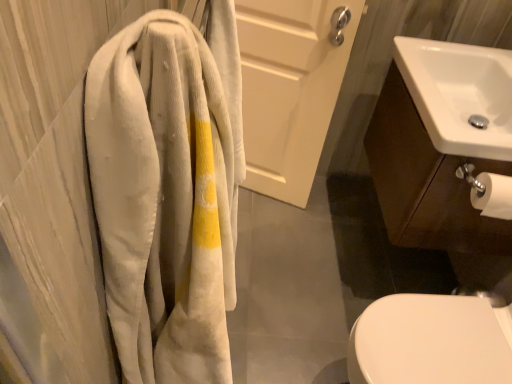
At what (x,y) coordinates should I click in order to perform the action: click on white matte door at upper center. Please return your answer as a coordinate pair (x, y). Looking at the image, I should click on (291, 87).

What do you see at coordinates (460, 95) in the screenshot?
I see `white glossy sink at upper right` at bounding box center [460, 95].

In order to click on corduroy towel at left in this screenshot , I will do `click(163, 199)`.

In the scene shown: Considering the relative sizes of white matte door at upper center and white glossy sink at right in the image provided, is white matte door at upper center taller than white glossy sink at right?

Yes.

Image resolution: width=512 pixels, height=384 pixels. I want to click on bathroom cabinet above the white matte door at upper center (from a real-world perspective), so click(x=426, y=180).

Is white matte door at upper center beside white glossy sink at right?

No.

Would you consider corduroy towel at left to be distant from white glossy sink at right?

No, corduroy towel at left is not far away from white glossy sink at right.

Does corduroy towel at left have a lesser height compared to white glossy sink at right?

Incorrect, the height of corduroy towel at left does not fall short of that of white glossy sink at right.

Based on the photo, between corduroy towel at left and white glossy sink at right, which one appears on the right side from the viewer's perspective?

From the viewer's perspective, white glossy sink at right appears more on the right side.

Between point (104, 61) and point (413, 165), which one is positioned in front?

The point (104, 61) is in front.

From the image's perspective, which one is positioned higher, white glossy sink at right or white matte door at upper center?

white matte door at upper center is shown above in the image.

Considering the points (405, 140) and (331, 95), which point is in front, point (405, 140) or point (331, 95)?

The point (405, 140) is closer to the camera.

From a real-world perspective, is white glossy sink at right located beneath white matte door at upper center?

No, from a real-world perspective, white glossy sink at right is not below white matte door at upper center.

Considering the relative sizes of white glossy sink at right and white matte door at upper center in the image provided, is white glossy sink at right smaller than white matte door at upper center?

Actually, white glossy sink at right might be larger than white matte door at upper center.

From their relative heights in the image, would you say white glossy sink at upper right is taller or shorter than white glossy sink at right?

white glossy sink at upper right is shorter than white glossy sink at right.

Would you consider white glossy sink at upper right to be distant from white glossy sink at right?

No, white glossy sink at upper right is not far away from white glossy sink at right.

Is white glossy sink at upper right surrounding white glossy sink at right?

No, white glossy sink at right is located outside of white glossy sink at upper right.

How far apart are white glossy sink at upper right and white glossy sink at right?

They are 18.99 centimeters apart.

Is point (97, 77) positioned after point (323, 56)?

That is False.

Would you say white matte door at upper center is part of corduroy towel at left's contents?

That's incorrect, white matte door at upper center is not inside corduroy towel at left.

Is corduroy towel at left smaller than white matte door at upper center?

Yes, corduroy towel at left is smaller than white matte door at upper center.

Considering the relative sizes of corduroy towel at left and white matte door at upper center in the image provided, is corduroy towel at left thinner than white matte door at upper center?

Incorrect, the width of corduroy towel at left is not less than that of white matte door at upper center.

Is white matte door at upper center at the right side of corduroy towel at left?

Indeed, white matte door at upper center is positioned on the right side of corduroy towel at left.

Which of these two, white matte door at upper center or corduroy towel at left, is bigger?

With larger size is white matte door at upper center.

Could you tell me if white matte door at upper center is facing corduroy towel at left?

Yes.

From a real-world perspective, is white matte door at upper center physically below corduroy towel at left?

Yes, from a real-world perspective, white matte door at upper center is under corduroy towel at left.

Which object is further away from the camera taking this photo, corduroy towel at left or white glossy sink at upper right?

white glossy sink at upper right is behind.

Is corduroy towel at left beside white glossy sink at upper right?

No, corduroy towel at left is not in contact with white glossy sink at upper right.

From the image's perspective, is corduroy towel at left on top of white glossy sink at upper right?

No, from the image's perspective, corduroy towel at left is not over white glossy sink at upper right.

Does corduroy towel at left appear on the left side of white glossy sink at upper right?

Yes.

Find the location of `screen door that appears on the left of white glossy sink at right`. screen door that appears on the left of white glossy sink at right is located at coordinates (291, 87).

Where is `bathroom cabinet on the right side of corduroy towel at left`? This screenshot has height=384, width=512. bathroom cabinet on the right side of corduroy towel at left is located at coordinates (426, 180).

Looking at the image, which one is located further to white matte door at upper center, white glossy sink at upper right or white glossy sink at right?

The object further to white matte door at upper center is white glossy sink at upper right.

Considering their positions, is white glossy sink at right positioned closer to corduroy towel at left than white glossy sink at upper right?

Based on the image, white glossy sink at right appears to be nearer to corduroy towel at left.

Looking at the image, which one is located further to corduroy towel at left, white glossy sink at right or white matte door at upper center?

The object further to corduroy towel at left is white matte door at upper center.

Based on the photo, considering their positions, is corduroy towel at left positioned further to white glossy sink at upper right than white glossy sink at right?

corduroy towel at left is positioned further to the anchor white glossy sink at upper right.

Looking at the image, which one is located further to corduroy towel at left, white glossy sink at upper right or white glossy sink at right?

white glossy sink at upper right is positioned further to the anchor corduroy towel at left.

From the image, which object appears to be nearer to white glossy sink at upper right, white matte door at upper center or white glossy sink at right?

The object closer to white glossy sink at upper right is white glossy sink at right.

Which object lies further to the anchor point white glossy sink at upper right, white glossy sink at right or corduroy towel at left?

corduroy towel at left.

Estimate the real-world distances between objects in this image. Which object is further from corduroy towel at left, white matte door at upper center or white glossy sink at upper right?

white matte door at upper center.

Find the location of a particular element. The height and width of the screenshot is (384, 512). bathroom cabinet located between white matte door at upper center and white glossy sink at upper right in the left-right direction is located at coordinates 426,180.

The height and width of the screenshot is (384, 512). What are the coordinates of `bathroom cabinet between corduroy towel at left and white glossy sink at upper right` in the screenshot? It's located at (426, 180).

The width and height of the screenshot is (512, 384). Find the location of `bathroom cabinet positioned between corduroy towel at left and white matte door at upper center from near to far`. bathroom cabinet positioned between corduroy towel at left and white matte door at upper center from near to far is located at coordinates (426, 180).

This screenshot has width=512, height=384. Find the location of `sink located between corduroy towel at left and white matte door at upper center in the depth direction`. sink located between corduroy towel at left and white matte door at upper center in the depth direction is located at coordinates tap(460, 95).